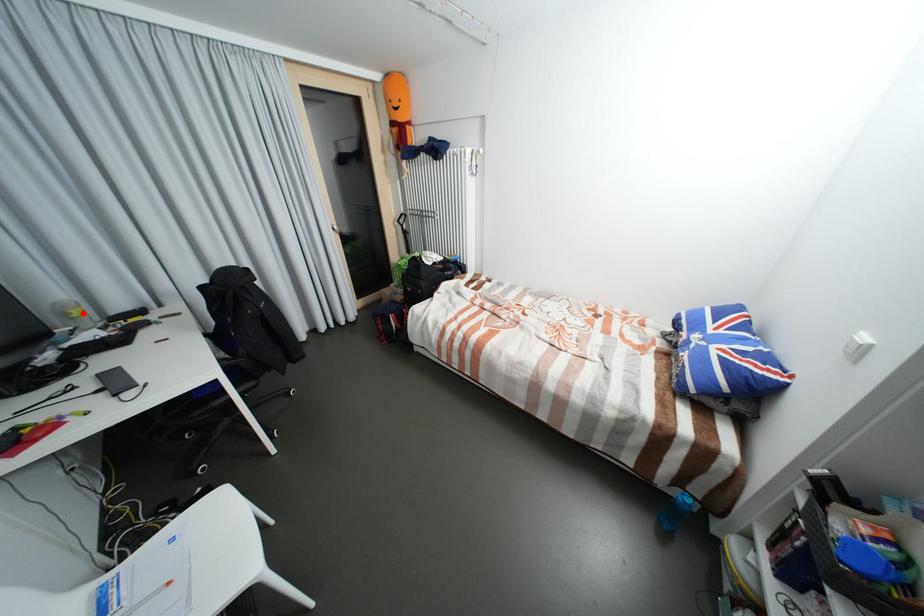
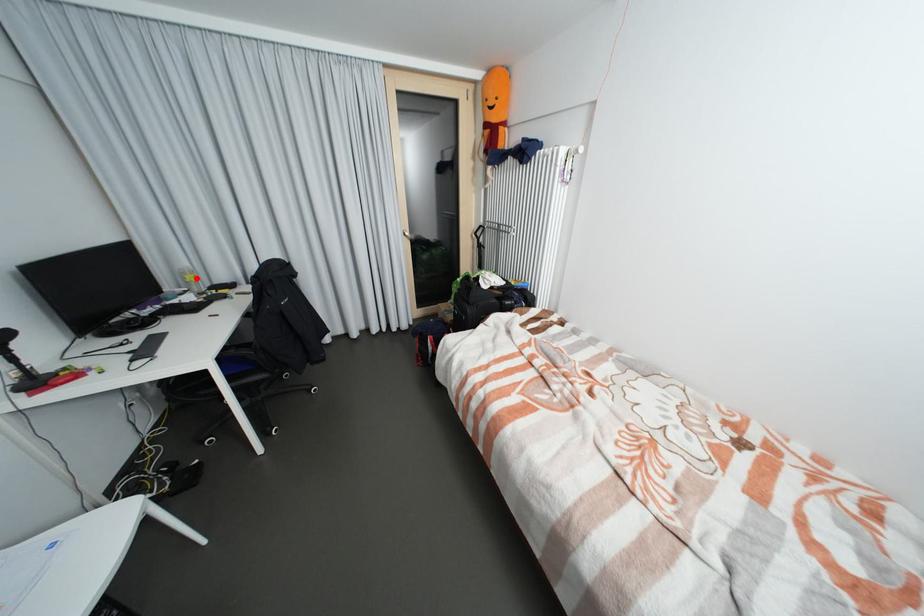
I am providing you with two images of the same scene from different viewpoints. A red point is marked on the first image and another point is marked on the second image. Is the marked point in image1 the same physical position as the marked point in image2?

Yes